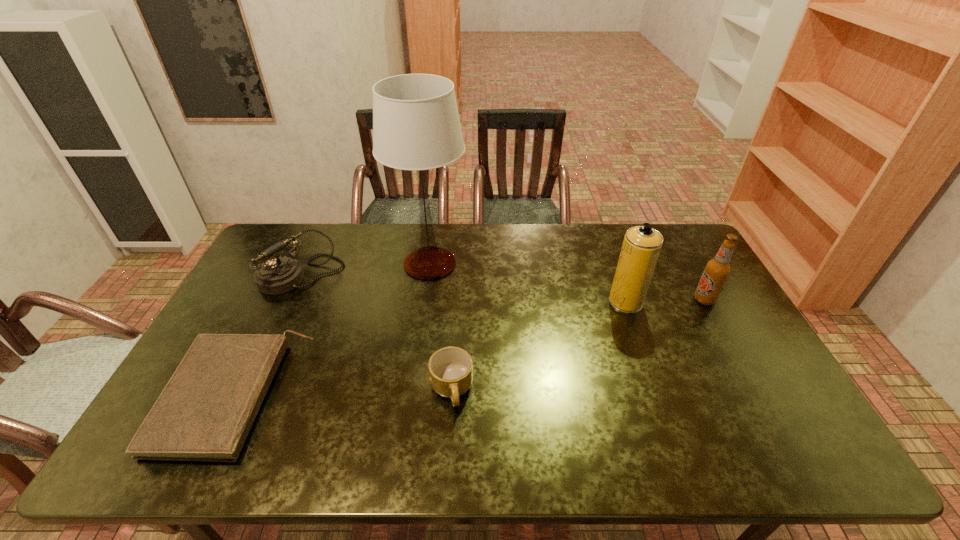
Identify the location of free space between the telephone and the fourth shortest object. The height and width of the screenshot is (540, 960). (503, 288).

Locate an element on the screen. free space between the table lamp and the mug is located at coordinates (441, 327).

You are a GUI agent. You are given a task and a screenshot of the screen. Output one action in this format:
    pyautogui.click(x=<x>, y=<y>)
    Task: Click on the vacant area that lies between the second tallest object and the second shortest object
    
    Given the screenshot: What is the action you would take?
    pyautogui.click(x=539, y=346)

This screenshot has height=540, width=960. I want to click on vacant area that lies between the aerosol can and the shortest object, so click(x=431, y=349).

This screenshot has height=540, width=960. In order to click on free point between the shortest object and the second shortest object in this screenshot , I will do `click(344, 393)`.

Image resolution: width=960 pixels, height=540 pixels. Identify the location of free area in between the second tallest object and the third tallest object. (665, 301).

Locate an element on the screen. The height and width of the screenshot is (540, 960). free spot between the second shortest object and the tallest object is located at coordinates (441, 327).

What are the coordinates of `the closest object to the paperback book` in the screenshot? It's located at (278, 275).

Where is `object that is the third closest to the third tallest object`? The width and height of the screenshot is (960, 540). object that is the third closest to the third tallest object is located at coordinates (451, 368).

This screenshot has height=540, width=960. Find the location of `vacant space that satisfies the following two spatial constraints: 1. on the front side of the third shortest object; 2. on the spine side of the shortest object`. vacant space that satisfies the following two spatial constraints: 1. on the front side of the third shortest object; 2. on the spine side of the shortest object is located at coordinates (245, 396).